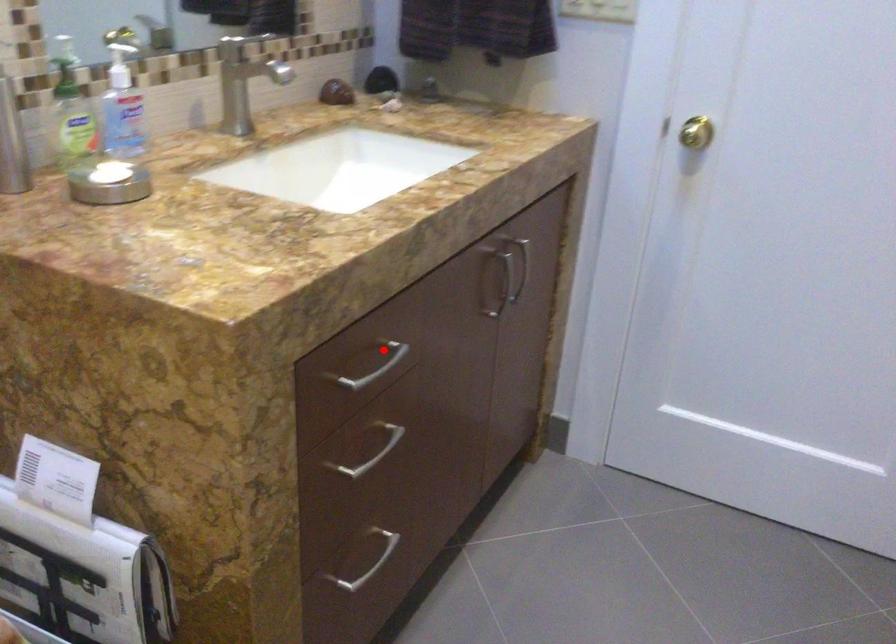
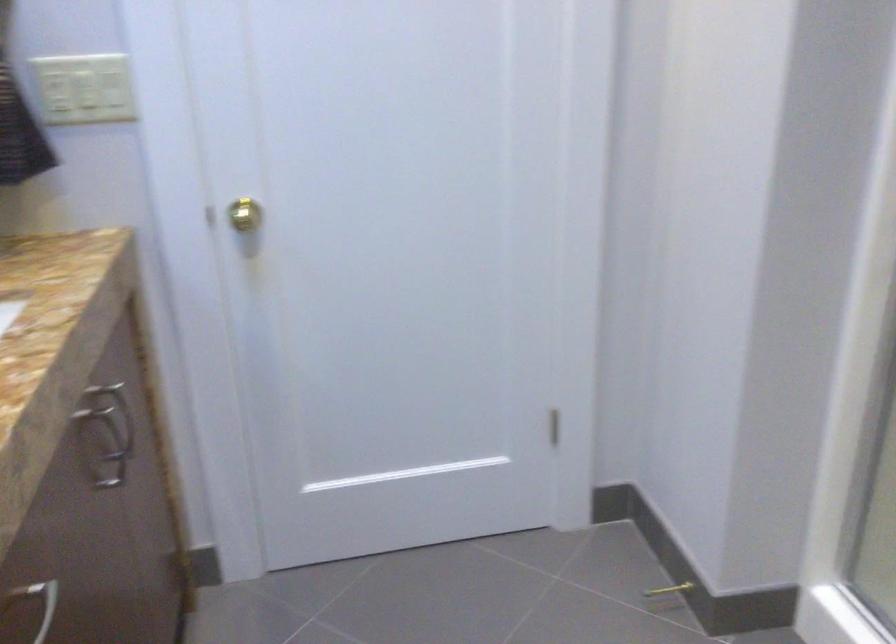
Question: I am providing you with two images of the same scene from different viewpoints. In image1, a red point is highlighted. Considering the same 3D point in image2, which of the following is correct?

Choices:
 (A) It is closer
 (B) It is farther

Answer: (A)